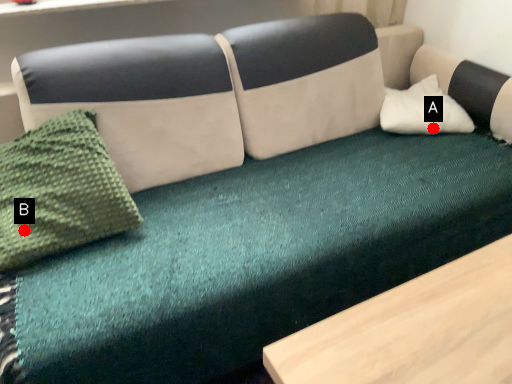
Question: Two points are circled on the image, labeled by A and B beside each circle. Which point is farther to the camera?

Choices:
 (A) A is further
 (B) B is further

Answer: (A)